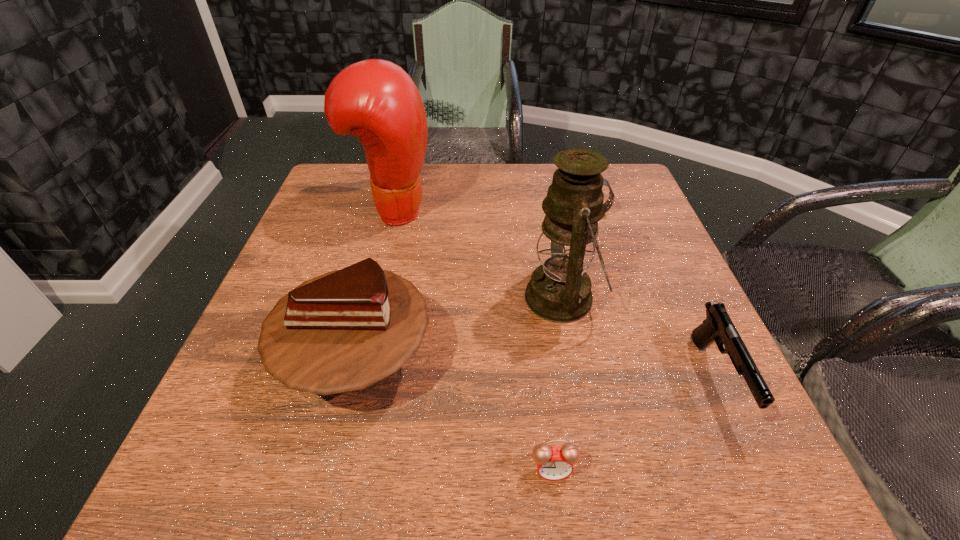
Image resolution: width=960 pixels, height=540 pixels. In order to click on empty space between the watch and the gun in this screenshot , I will do `click(653, 296)`.

This screenshot has width=960, height=540. Find the location of `free spot between the fourth shortest object and the gun`. free spot between the fourth shortest object and the gun is located at coordinates (537, 370).

You are a GUI agent. You are given a task and a screenshot of the screen. Output one action in this format:
    pyautogui.click(x=<x>, y=<y>)
    Task: Click on the vacant region between the oil lamp and the third tallest object
    
    Given the screenshot: What is the action you would take?
    pyautogui.click(x=460, y=329)

Where is `vacant area between the fourth shortest object and the oil lamp`? vacant area between the fourth shortest object and the oil lamp is located at coordinates (460, 329).

Image resolution: width=960 pixels, height=540 pixels. Find the location of `object that is the fourth closest to the shortest object`. object that is the fourth closest to the shortest object is located at coordinates pos(375,100).

You are a GUI agent. You are given a task and a screenshot of the screen. Output one action in this format:
    pyautogui.click(x=<x>, y=<y>)
    Task: Click on the fourth closest object to the nearest object
    
    Given the screenshot: What is the action you would take?
    pyautogui.click(x=375, y=100)

The height and width of the screenshot is (540, 960). I want to click on free space that satisfies the following two spatial constraints: 1. on the face of the watch; 2. on the clock face of the nearest object, so click(x=671, y=470).

At what (x,y) coordinates should I click in order to perform the action: click on vacant position in the image that satisfies the following two spatial constraints: 1. on the striking surface of the cake; 2. on the right side of the boxing glove. Please return your answer as a coordinate pair (x, y). The image size is (960, 540). Looking at the image, I should click on (355, 361).

The height and width of the screenshot is (540, 960). Find the location of `vacant space that satisfies the following two spatial constraints: 1. on the face of the watch; 2. on the front side of the oil lamp`. vacant space that satisfies the following two spatial constraints: 1. on the face of the watch; 2. on the front side of the oil lamp is located at coordinates (616, 298).